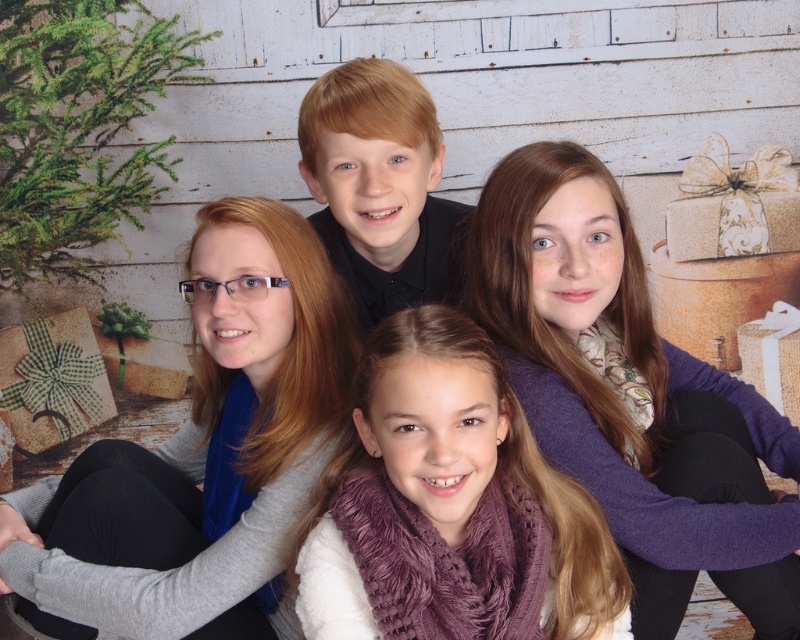
You are taking a group photo with two people wearing scarves. The scene has a festive holiday theme with a rustic wooden backdrop. You notice the purple knit scarf at upper right and the gray wool scarf at upper left. Which scarf is located to the right of the other?

The purple knit scarf at upper right is positioned on the right side of gray wool scarf at upper left.

You are a photographer trying to adjust lighting for a group photo. The scene has a purple knit scarf at upper right and a person with blonde hair at center. Which object would cast a larger shadow if the light source is directly above them?

The purple knit scarf at upper right would cast a larger shadow because it is larger in size than the blonde hair at center.

Consider the image. You are a photographer trying to adjust the lighting for a group photo. You notice the purple knit scarf at upper right and the blonde hair at center. Which object is wider in the image?

The purple knit scarf at upper right is wider than the blonde hair at center according to the description.